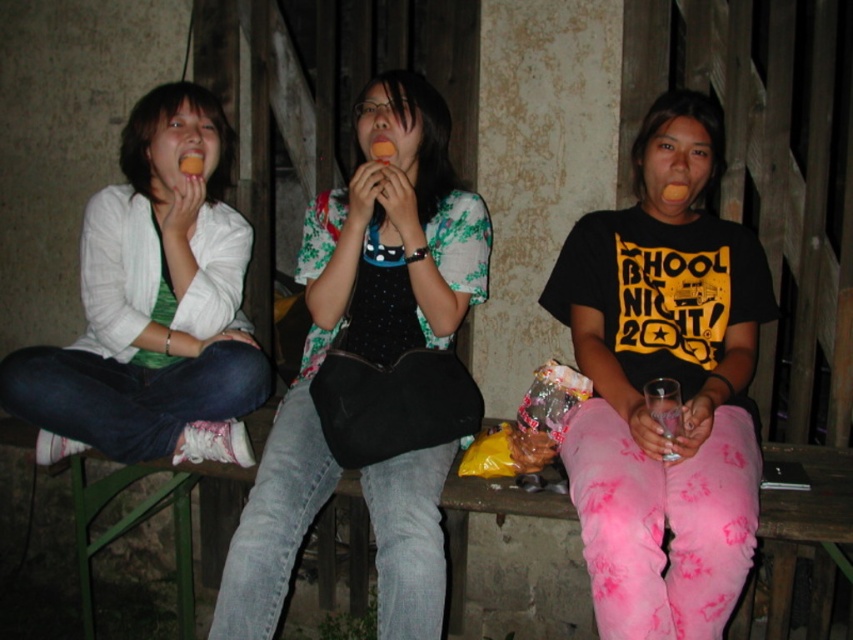
Question: Which point is farther from the camera taking this photo?

Choices:
 (A) (432, 275)
 (B) (161, 96)

Answer: (B)

Question: Does matte black t-shirt at center appear under matte white cardigan at left?

Choices:
 (A) no
 (B) yes

Answer: (B)

Question: Among these objects, which one is farthest from the camera?

Choices:
 (A) floral fabric top at center
 (B) matte white cardigan at left

Answer: (B)

Question: Is matte black t-shirt at center positioned behind matte white cardigan at left?

Choices:
 (A) yes
 (B) no

Answer: (B)

Question: Is floral fabric top at center wider than matte white cardigan at left?

Choices:
 (A) yes
 (B) no

Answer: (B)

Question: Which point appears farthest from the camera in this image?

Choices:
 (A) (554, 307)
 (B) (408, 102)

Answer: (A)